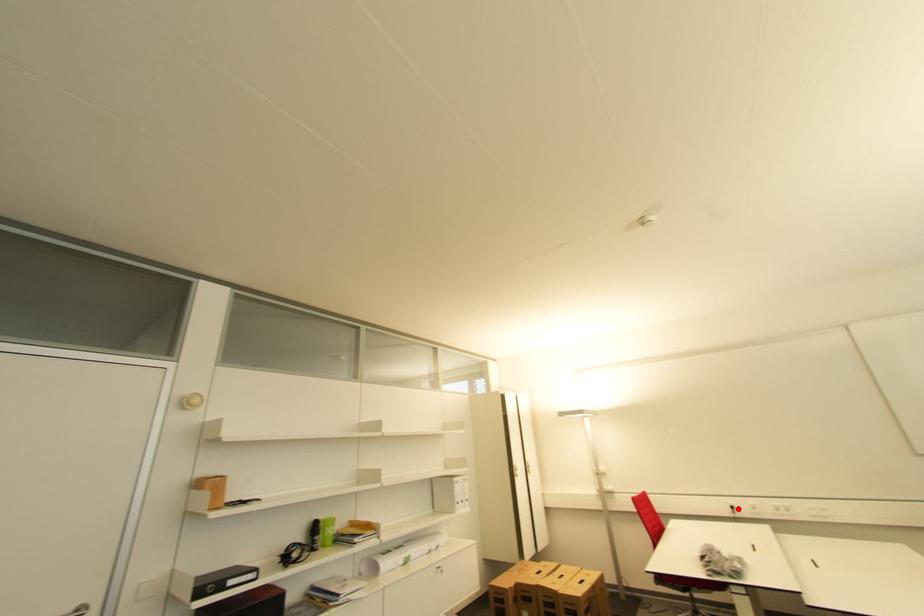
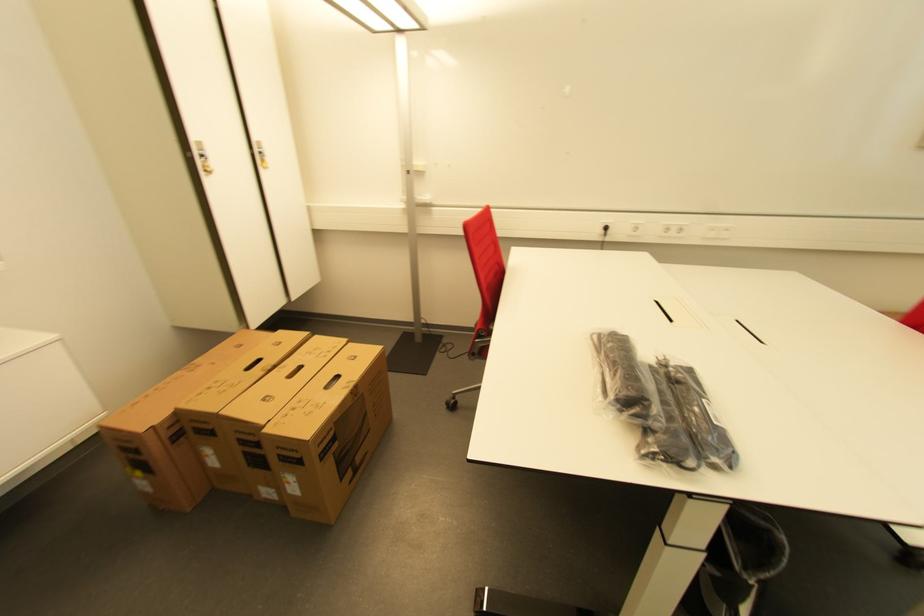
The point at the highlighted location is marked in the first image. Where is the corresponding point in the second image?

(611, 230)